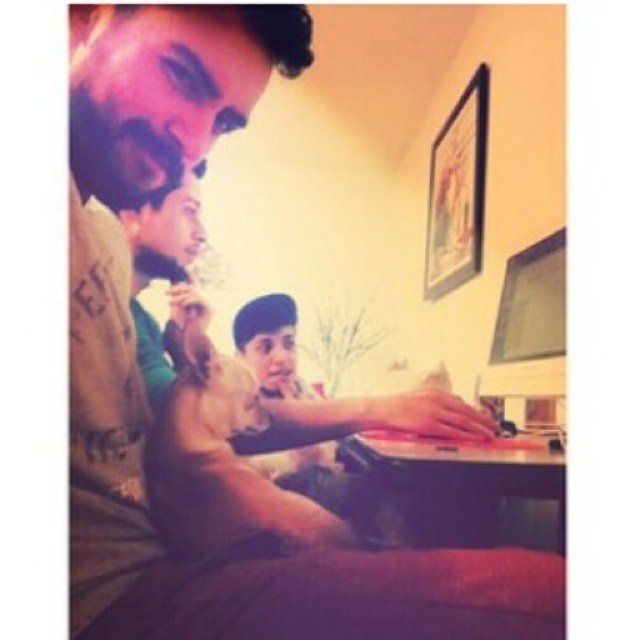
Which is more to the left, matte brown shirt at left or matte brown hair at upper left?

From the viewer's perspective, matte brown shirt at left appears more on the left side.

Is matte brown shirt at left bigger than matte brown hair at upper left?

Yes.

Does point (104, 186) come closer to viewer compared to point (196, 168)?

Yes.

You are a GUI agent. You are given a task and a screenshot of the screen. Output one action in this format:
    pyautogui.click(x=<x>, y=<y>)
    Task: Click on the matte brown shirt at left
    The image size is (640, 640).
    Given the screenshot: What is the action you would take?
    pyautogui.click(x=128, y=241)

Does matte brown hair at upper left appear under matte plastic monitor at upper right?

Actually, matte brown hair at upper left is above matte plastic monitor at upper right.

Who is lower down, matte brown hair at upper left or matte plastic monitor at upper right?

matte plastic monitor at upper right is below.

Identify the location of matte brown hair at upper left. (164, 275).

The width and height of the screenshot is (640, 640). In order to click on matte brown hair at upper left in this screenshot , I will do `click(164, 275)`.

Does matte brown shirt at left have a lesser width compared to matte plastic monitor at upper right?

In fact, matte brown shirt at left might be wider than matte plastic monitor at upper right.

Can you confirm if matte brown shirt at left is positioned above matte plastic monitor at upper right?

Indeed, matte brown shirt at left is positioned over matte plastic monitor at upper right.

I want to click on matte brown shirt at left, so click(128, 241).